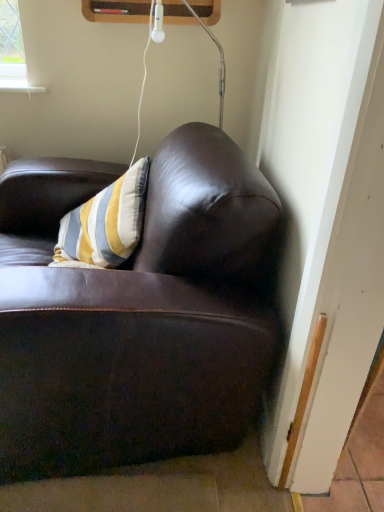
Question: From a real-world perspective, is matte white lamp at upper center above or below shiny brown leather couch at upper right?

Choices:
 (A) below
 (B) above

Answer: (B)

Question: Is matte white lamp at upper center wider or thinner than shiny brown leather couch at upper right?

Choices:
 (A) thin
 (B) wide

Answer: (A)

Question: Considering the positions of point (221, 61) and point (125, 432), is point (221, 61) closer or farther from the camera than point (125, 432)?

Choices:
 (A) farther
 (B) closer

Answer: (A)

Question: Is shiny brown leather couch at upper right bigger or smaller than matte white lamp at upper center?

Choices:
 (A) small
 (B) big

Answer: (B)

Question: Considering the positions of shiny brown leather couch at upper right and matte white lamp at upper center in the image, is shiny brown leather couch at upper right wider or thinner than matte white lamp at upper center?

Choices:
 (A) wide
 (B) thin

Answer: (A)

Question: In terms of height, does shiny brown leather couch at upper right look taller or shorter compared to matte white lamp at upper center?

Choices:
 (A) tall
 (B) short

Answer: (A)

Question: Choose the correct answer: Is shiny brown leather couch at upper right inside matte white lamp at upper center or outside it?

Choices:
 (A) inside
 (B) outside

Answer: (B)